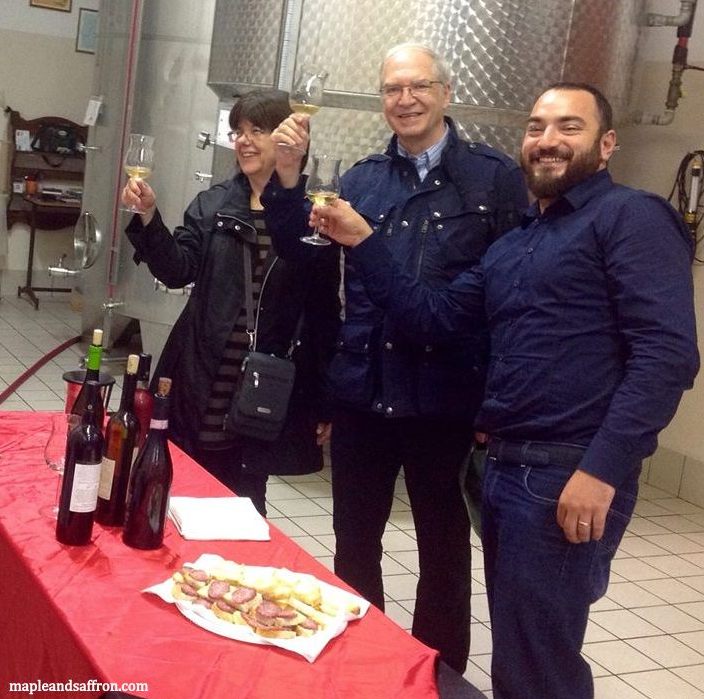
Locate an element on the screen. This screenshot has width=704, height=699. tiled floor is located at coordinates (x=669, y=614), (x=25, y=340).